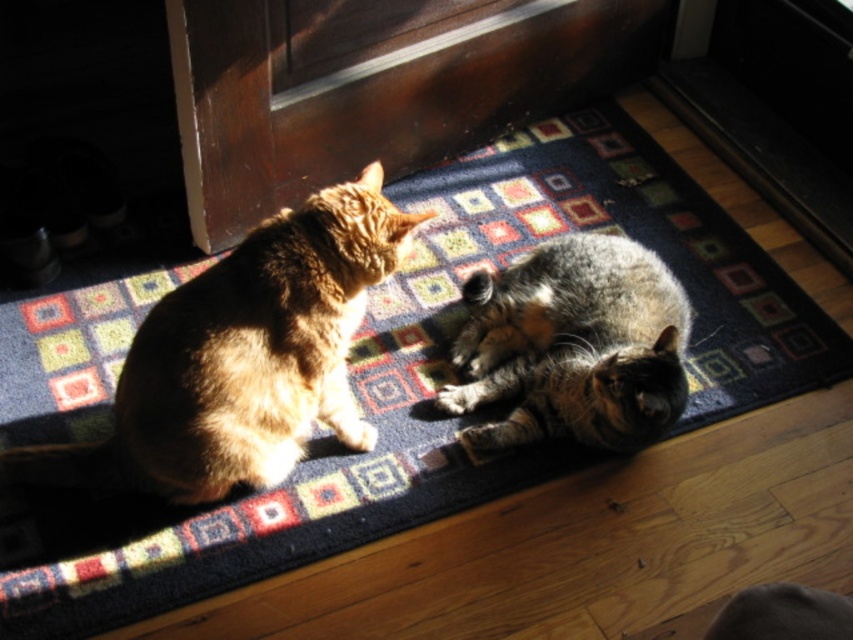
Question: Which object is closer to the camera taking this photo?

Choices:
 (A) tabby fur cat at lower center
 (B) tabby fur cat at left
 (C) wooden screen door at upper center

Answer: (B)

Question: Which point appears farthest from the camera in this image?

Choices:
 (A) (289, 381)
 (B) (573, 403)

Answer: (B)

Question: Does wooden screen door at upper center have a lesser width compared to tabby fur cat at lower center?

Choices:
 (A) no
 (B) yes

Answer: (A)

Question: Is wooden screen door at upper center thinner than tabby fur cat at left?

Choices:
 (A) no
 (B) yes

Answer: (A)

Question: Estimate the real-world distances between objects in this image. Which object is closer to the wooden screen door at upper center?

Choices:
 (A) tabby fur cat at lower center
 (B) tabby fur cat at left

Answer: (B)

Question: Is tabby fur cat at left further to the viewer compared to tabby fur cat at lower center?

Choices:
 (A) no
 (B) yes

Answer: (A)